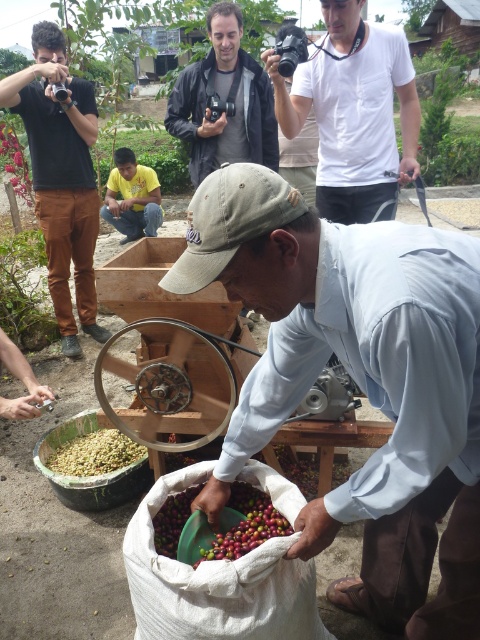
Question: Does matte black jacket at center come in front of green matte coffee beans at lower left?

Choices:
 (A) yes
 (B) no

Answer: (B)

Question: Among these points, which one is farthest from the camera?

Choices:
 (A) (50, 278)
 (B) (448, 372)
 (C) (406, 99)

Answer: (A)

Question: Is white cotton shirt at upper center positioned in front of matte black camera at upper left?

Choices:
 (A) yes
 (B) no

Answer: (A)

Question: Does light brown cotton shirt at center have a greater width compared to white cotton shirt at upper center?

Choices:
 (A) no
 (B) yes

Answer: (A)

Question: Considering the real-world distances, which object is closest to the green matte coffee beans at lower left?

Choices:
 (A) white cotton shirt at upper center
 (B) matte black jacket at center
 (C) light brown cotton shirt at center

Answer: (C)

Question: Which object is the farthest from the white cotton shirt at upper center?

Choices:
 (A) green matte coffee beans at center
 (B) light brown cotton shirt at center
 (C) green matte coffee beans at lower left
 (D) matte black jacket at center

Answer: (A)